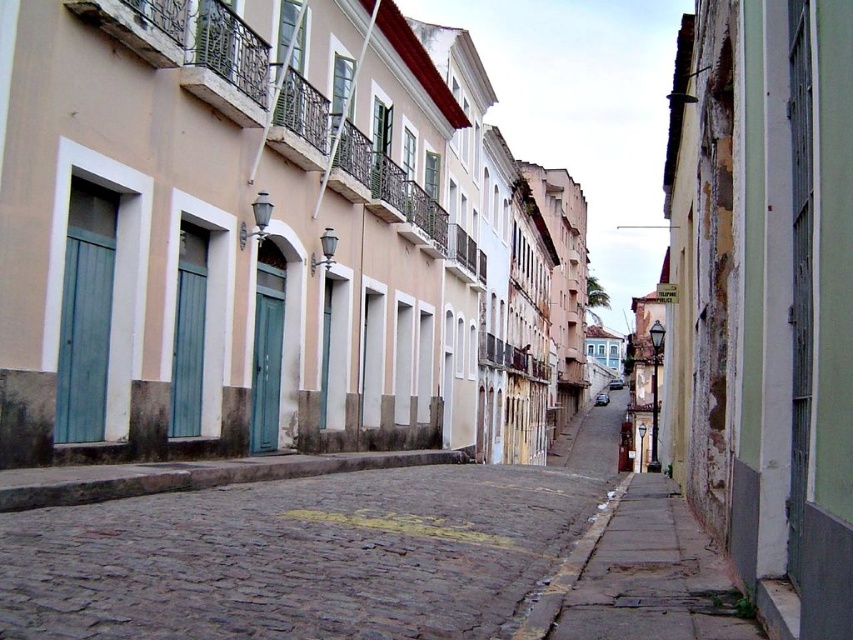
You are a delivery person with a heavy cart that needs to move from the brown cobblestone pavement at center to the smooth concrete sidewalk at lower right. Considering the height difference between the two surfaces, will you be able to move your cart smoothly without any difficulty?

The brown cobblestone pavement at center is much taller than the smooth concrete sidewalk at lower right, so moving the cart from the brown cobblestone pavement at center to the smooth concrete sidewalk at lower right may be challenging due to the height difference. You might need to adjust the cart carefully to navigate the step between them.

You are a delivery person with a cart that requires a flat surface to move smoothly. You see the brown cobblestone pavement at center and the smooth concrete sidewalk at lower right. Which surface would allow your cart to move more smoothly?

The smooth concrete sidewalk at lower right would allow the cart to move more smoothly because it is a flat surface, whereas the brown cobblestone pavement at center has uneven stones that could make movement difficult.